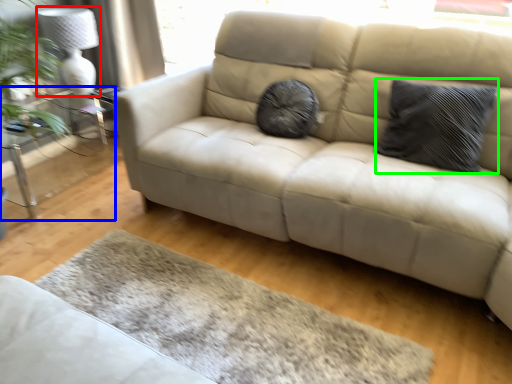
Question: Which object is positioned closest to lamp (highlighted by a red box)? Select from table (highlighted by a blue box) and pillow (highlighted by a green box).

Choices:
 (A) table
 (B) pillow

Answer: (A)